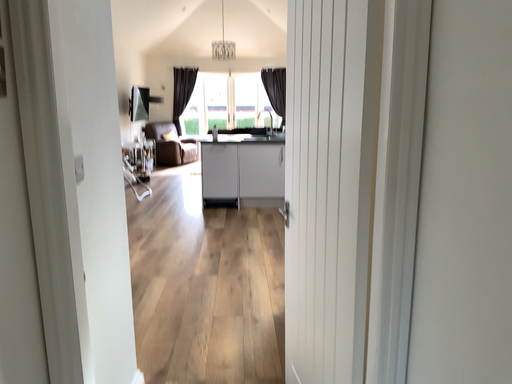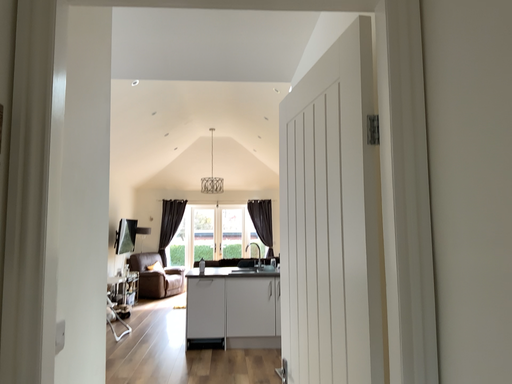
Question: Which way did the camera rotate in the video?

Choices:
 (A) rotated upward
 (B) rotated downward

Answer: (A)